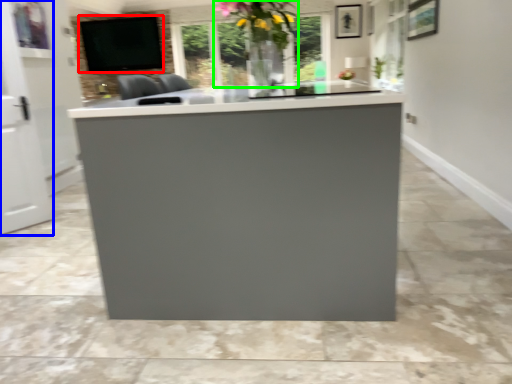
Question: Considering the real-world distances, which object is closest to window screen (highlighted by a red box)? glass door (highlighted by a blue box) or floral arrangement (highlighted by a green box).

Choices:
 (A) glass door
 (B) floral arrangement

Answer: (B)